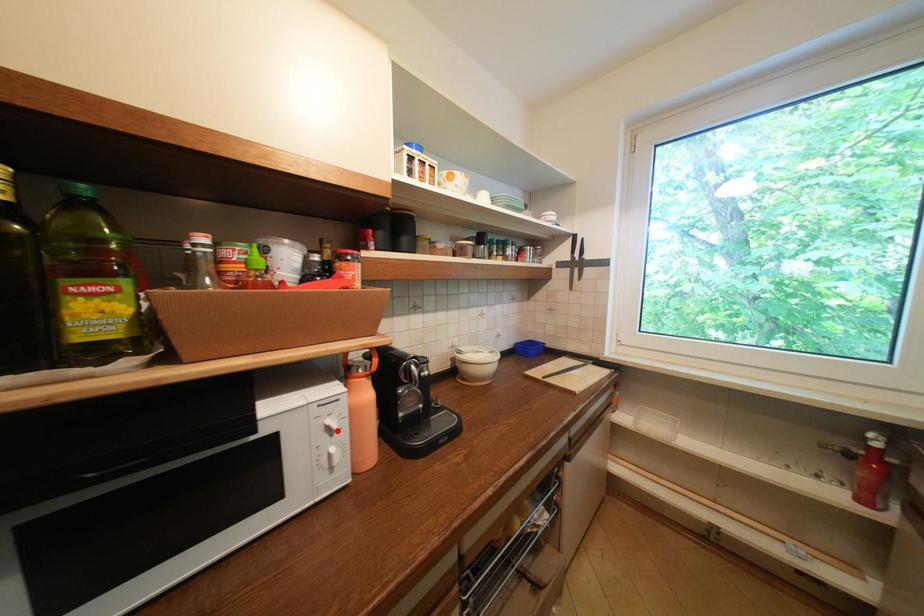
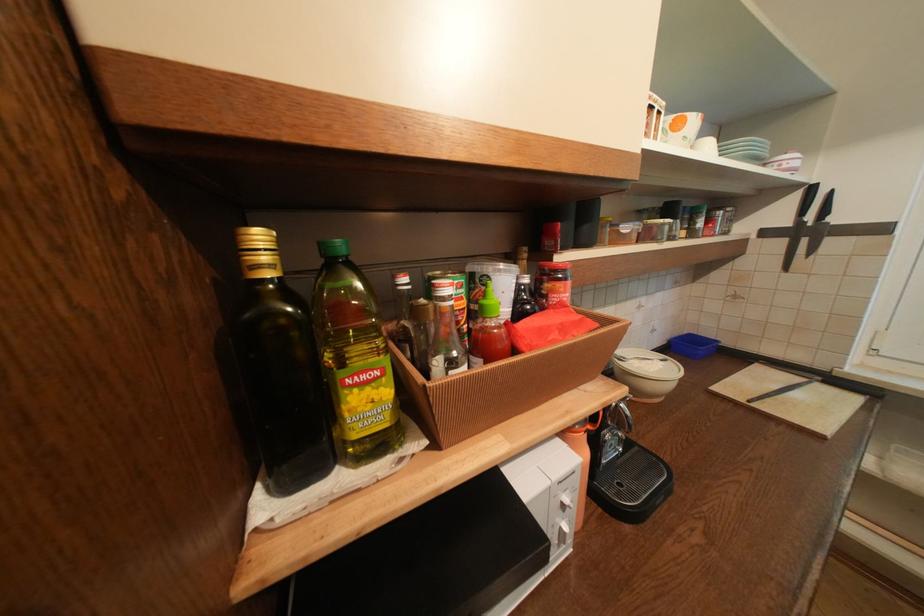
Find the pixel in the second image that matches the highlighted location in the first image.

(573, 507)